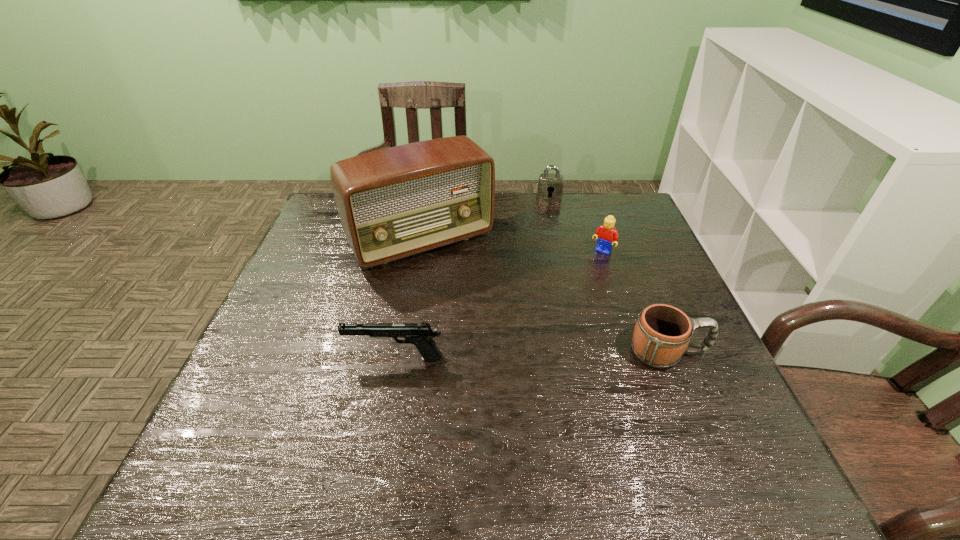
Image resolution: width=960 pixels, height=540 pixels. In order to click on object that is at the left edge in this screenshot , I will do (396, 202).

Locate an element on the screen. This screenshot has width=960, height=540. mug that is at the right edge is located at coordinates (662, 333).

Identify the location of Lego present at the right edge. (607, 235).

Identify the location of object present at the far left corner. The image size is (960, 540). (396, 202).

This screenshot has height=540, width=960. I want to click on vacant space at the far edge of the desktop, so click(502, 200).

Where is `free space at the near edge of the desktop`? This screenshot has width=960, height=540. free space at the near edge of the desktop is located at coordinates (492, 407).

Identify the location of vacant space at the left edge of the desktop. Image resolution: width=960 pixels, height=540 pixels. (293, 286).

Locate an element on the screen. Image resolution: width=960 pixels, height=540 pixels. free spot at the right edge of the desktop is located at coordinates (647, 299).

I want to click on vacant space at the near left corner, so click(x=251, y=420).

I want to click on vacant space at the far right corner of the desktop, so click(623, 224).